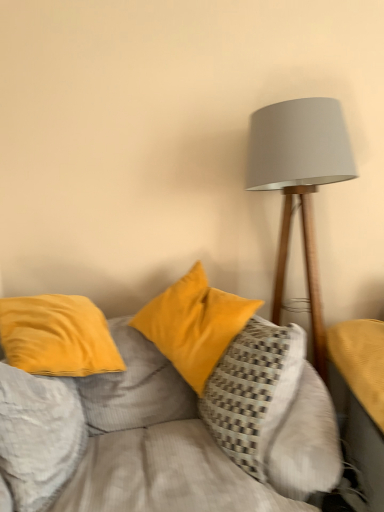
Question: Is velvet yellow pillow at center, positioned as the 3th pillow in left-to-right order, bigger than yellow fabric table at right?

Choices:
 (A) no
 (B) yes

Answer: (B)

Question: Does velvet yellow pillow at center, which is the first pillow in right-to-left order, appear on the right side of yellow fabric table at right?

Choices:
 (A) no
 (B) yes

Answer: (A)

Question: Is velvet yellow pillow at center, which is the first pillow in right-to-left order, not close to yellow fabric table at right?

Choices:
 (A) no
 (B) yes

Answer: (A)

Question: Does velvet yellow pillow at center, positioned as the 3th pillow in left-to-right order, have a lesser height compared to yellow fabric table at right?

Choices:
 (A) no
 (B) yes

Answer: (A)

Question: From the image's perspective, does velvet yellow pillow at center, positioned as the 3th pillow in left-to-right order, appear lower than yellow fabric table at right?

Choices:
 (A) no
 (B) yes

Answer: (B)

Question: Is velvet yellow pillow at center, which is the first pillow in right-to-left order, outside of yellow fabric table at right?

Choices:
 (A) yes
 (B) no

Answer: (A)

Question: Is velvet yellow pillows at center closer to camera compared to velvet yellow pillow at center, positioned as the 3th pillow in left-to-right order?

Choices:
 (A) no
 (B) yes

Answer: (B)

Question: Does velvet yellow pillows at center have a smaller size compared to velvet yellow pillow at center, which is the first pillow in right-to-left order?

Choices:
 (A) no
 (B) yes

Answer: (A)

Question: Does velvet yellow pillows at center appear on the right side of velvet yellow pillow at center, which is the first pillow in right-to-left order?

Choices:
 (A) yes
 (B) no

Answer: (B)

Question: Is velvet yellow pillows at center not close to velvet yellow pillow at center, which is the first pillow in right-to-left order?

Choices:
 (A) no
 (B) yes

Answer: (A)

Question: Is velvet yellow pillows at center bigger than velvet yellow pillow at center, which is the first pillow in right-to-left order?

Choices:
 (A) no
 (B) yes

Answer: (B)

Question: From the image's perspective, is velvet yellow pillows at center located beneath velvet yellow pillow at center, positioned as the 3th pillow in left-to-right order?

Choices:
 (A) yes
 (B) no

Answer: (A)

Question: Considering the relative sizes of matte gray lampshade at right and yellow fabric table at right in the image provided, is matte gray lampshade at right smaller than yellow fabric table at right?

Choices:
 (A) yes
 (B) no

Answer: (B)